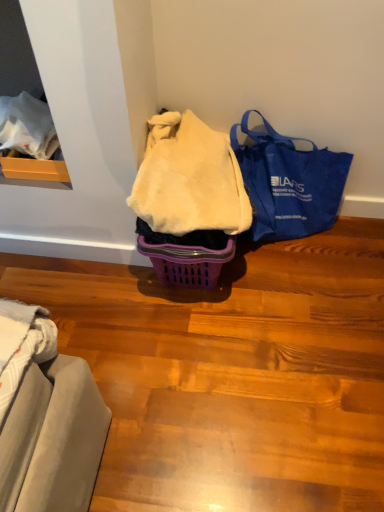
Question: Looking at the image, does white fluffy blanket at center seem bigger or smaller compared to blue canvas tote bag at right?

Choices:
 (A) big
 (B) small

Answer: (B)

Question: Which is correct: white fluffy blanket at center is inside blue canvas tote bag at right, or outside of it?

Choices:
 (A) inside
 (B) outside

Answer: (B)

Question: Is white fluffy blanket at center in front of or behind blue canvas tote bag at right in the image?

Choices:
 (A) behind
 (B) front

Answer: (B)

Question: Considering their positions, is blue canvas tote bag at right located in front of or behind white fluffy blanket at center?

Choices:
 (A) front
 (B) behind

Answer: (B)

Question: Is point (321, 177) positioned closer to the camera than point (168, 211)?

Choices:
 (A) farther
 (B) closer

Answer: (A)

Question: Do you think blue canvas tote bag at right is within white fluffy blanket at center, or outside of it?

Choices:
 (A) inside
 (B) outside

Answer: (B)

Question: Considering the positions of blue canvas tote bag at right and white fluffy blanket at center in the image, is blue canvas tote bag at right taller or shorter than white fluffy blanket at center?

Choices:
 (A) short
 (B) tall

Answer: (B)